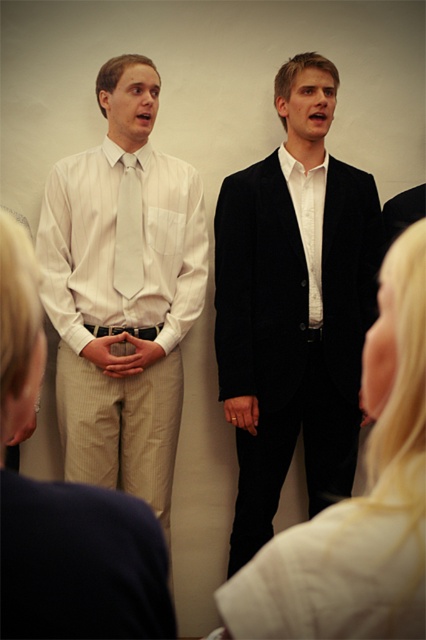
Question: Which point is farther to the camera?

Choices:
 (A) white smooth shirt at center
 (B) white satin shirt at left
 (C) white striped shirt at center

Answer: (A)

Question: Does white striped shirt at left appear under blonde hair at center?

Choices:
 (A) no
 (B) yes

Answer: (A)

Question: In this image, where is blonde hair at center located relative to white satin shirt at left?

Choices:
 (A) left
 (B) right

Answer: (B)

Question: Which of the following is the farthest from the observer?

Choices:
 (A) (146, 230)
 (B) (425, 340)
 (C) (51, 252)
 (D) (317, 173)

Answer: (D)

Question: Is white striped shirt at left smaller than white striped shirt at center?

Choices:
 (A) yes
 (B) no

Answer: (B)

Question: Which is nearer to the white smooth shirt at center?

Choices:
 (A) white striped shirt at left
 (B) matte white tie at center
 (C) white striped shirt at center

Answer: (B)